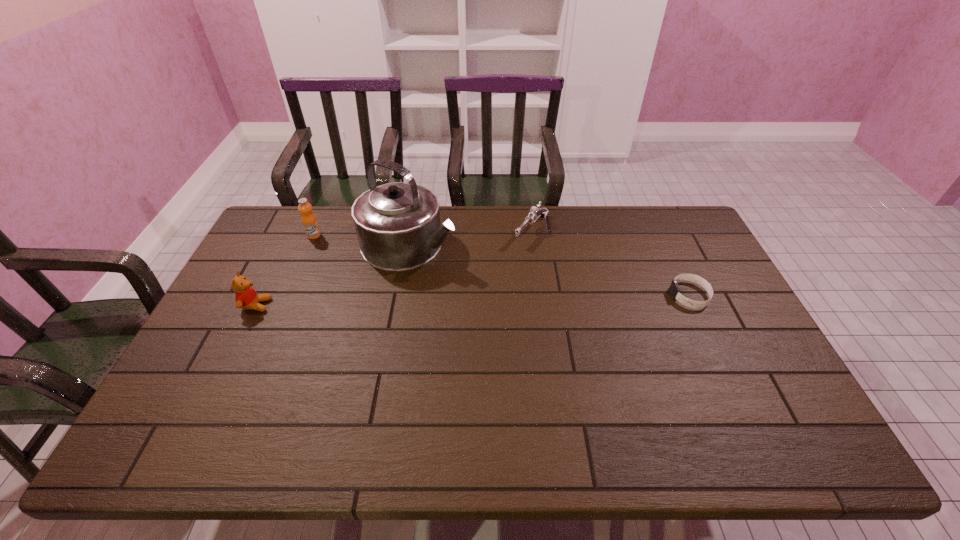
Where is `vacant area situated on the front label of the second tallest object`? vacant area situated on the front label of the second tallest object is located at coordinates (344, 254).

Locate an element on the screen. vacant area located on the front label of the second tallest object is located at coordinates (394, 286).

Identify the location of free space located 0.130m on the front label of the second tallest object. Image resolution: width=960 pixels, height=540 pixels. (342, 253).

In order to click on gun that is at the far edge in this screenshot , I will do `click(535, 213)`.

Locate an element on the screen. kettle that is positioned at the far edge is located at coordinates (398, 227).

Locate an element on the screen. Image resolution: width=960 pixels, height=540 pixels. orange juice that is at the far edge is located at coordinates (309, 221).

What are the coordinates of `teddy bear present at the left edge` in the screenshot? It's located at (246, 297).

Identify the location of orange juice that is at the left edge. click(309, 221).

Image resolution: width=960 pixels, height=540 pixels. Identify the location of object that is at the right edge. (674, 289).

Where is `object located in the far left corner section of the desktop`? This screenshot has height=540, width=960. object located in the far left corner section of the desktop is located at coordinates (309, 221).